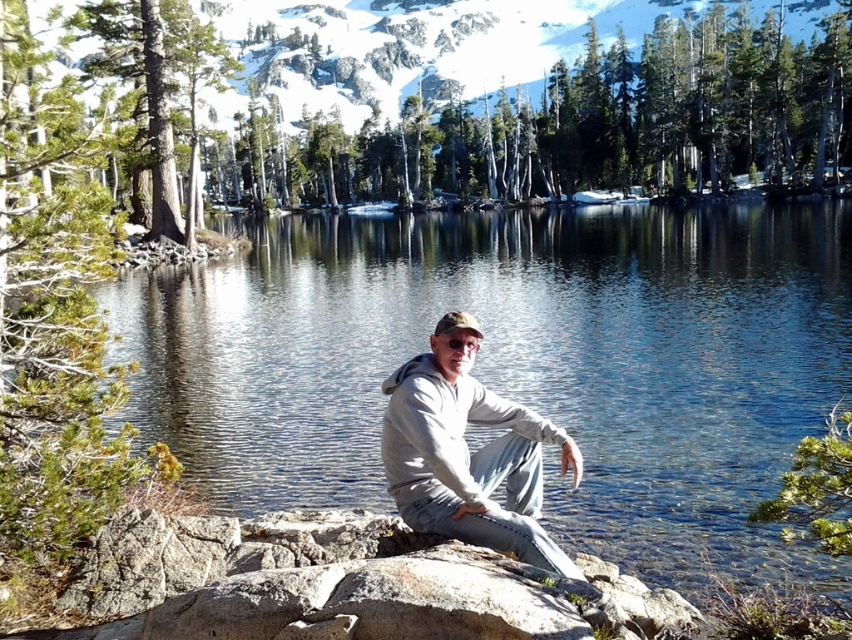
Question: Does clear water at center have a lesser width compared to gray matte hoodie at center?

Choices:
 (A) yes
 (B) no

Answer: (B)

Question: Can you confirm if clear water at center is bigger than gray matte hoodie at center?

Choices:
 (A) yes
 (B) no

Answer: (A)

Question: Does clear water at center appear on the left side of gray matte hoodie at center?

Choices:
 (A) yes
 (B) no

Answer: (B)

Question: Which point appears farthest from the camera in this image?

Choices:
 (A) (720, 236)
 (B) (398, 403)

Answer: (A)